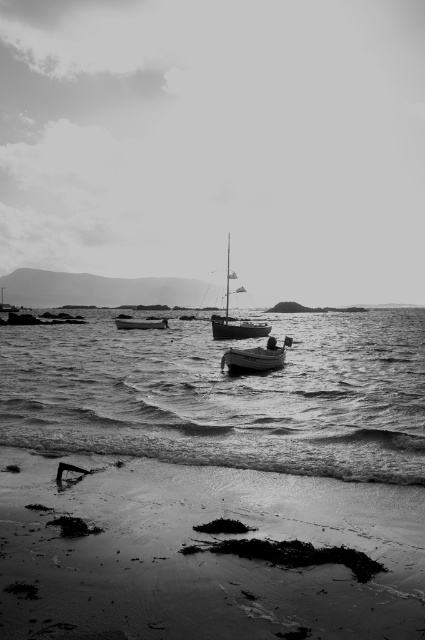
You are standing on the beach and want to walk to the wooden sailboat at center. Which direction should you go to reach it from the smooth sand at lower center?

The wooden sailboat at center is further away from the viewer than the smooth sand at lower center, so you should walk forward towards the water to reach it.

You are standing on the beach looking at the scene. Which object is located lower in the image, the smooth sand at lower center or the smooth water at center?

The smooth sand at lower center is located lower in the image than the smooth water at center, as it is positioned below it.